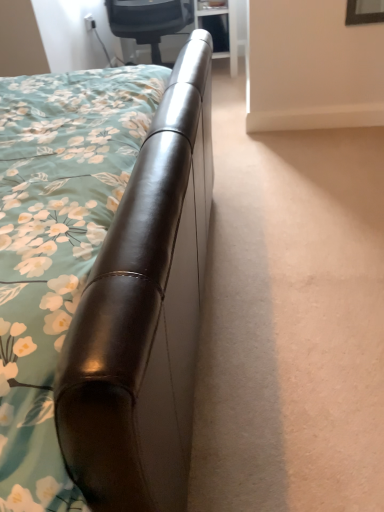
Question: In terms of height, does brown leather bed at upper left look taller or shorter compared to matte black chair at upper center?

Choices:
 (A) tall
 (B) short

Answer: (A)

Question: Would you say brown leather bed at upper left is inside or outside matte black chair at upper center?

Choices:
 (A) outside
 (B) inside

Answer: (A)

Question: From the image's perspective, is brown leather bed at upper left located above or below matte black chair at upper center?

Choices:
 (A) below
 (B) above

Answer: (A)

Question: Considering the positions of point (155, 59) and point (135, 202), is point (155, 59) closer or farther from the camera than point (135, 202)?

Choices:
 (A) farther
 (B) closer

Answer: (A)

Question: Relative to brown leather bed at upper left, is matte black chair at upper center in front or behind?

Choices:
 (A) behind
 (B) front

Answer: (A)

Question: From the image's perspective, is matte black chair at upper center positioned above or below brown leather bed at upper left?

Choices:
 (A) above
 (B) below

Answer: (A)

Question: In the image, is matte black chair at upper center on the left side or the right side of brown leather bed at upper left?

Choices:
 (A) right
 (B) left

Answer: (A)